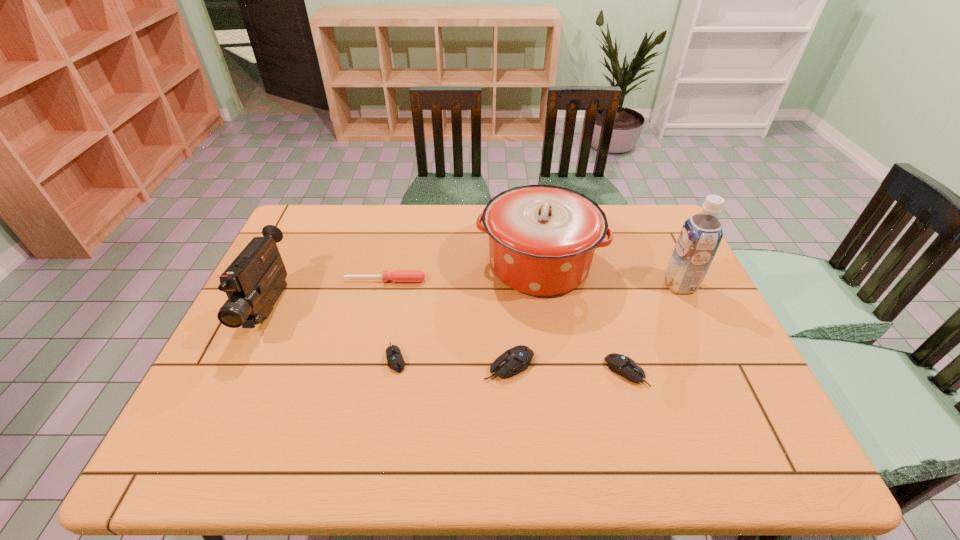
Where is `empty space that is in between the camcorder and the shortest computer mouse`? empty space that is in between the camcorder and the shortest computer mouse is located at coordinates (332, 333).

Locate an element on the screen. The height and width of the screenshot is (540, 960). free space that is in between the camcorder and the casserole is located at coordinates (404, 286).

At what (x,y) coordinates should I click in order to perform the action: click on vacant space that is in between the second shortest computer mouse and the camcorder. Please return your answer as a coordinate pair (x, y). Looking at the image, I should click on (447, 340).

The image size is (960, 540). I want to click on free space that is in between the rightmost computer mouse and the tallest computer mouse, so click(x=567, y=368).

At what (x,y) coordinates should I click in order to perform the action: click on blank region between the leftmost object and the leftmost computer mouse. Please return your answer as a coordinate pair (x, y). This screenshot has width=960, height=540. Looking at the image, I should click on (332, 333).

Where is `empty space that is in between the casserole and the tallest computer mouse`? The image size is (960, 540). empty space that is in between the casserole and the tallest computer mouse is located at coordinates (524, 315).

I want to click on object that ranks as the fourth closest to the casserole, so click(x=622, y=365).

Point out which object is positioned as the fourth nearest to the second tallest computer mouse. Please provide its 2D coordinates. Your answer should be formatted as a tuple, i.e. [(x, y)], where the tuple contains the x and y coordinates of a point satisfying the conditions above.

[(395, 360)]

Identify which computer mouse is the third nearest to the screwdriver. Please provide its 2D coordinates. Your answer should be formatted as a tuple, i.e. [(x, y)], where the tuple contains the x and y coordinates of a point satisfying the conditions above.

[(622, 365)]

I want to click on computer mouse object that ranks as the third closest to the rightmost object, so click(x=395, y=360).